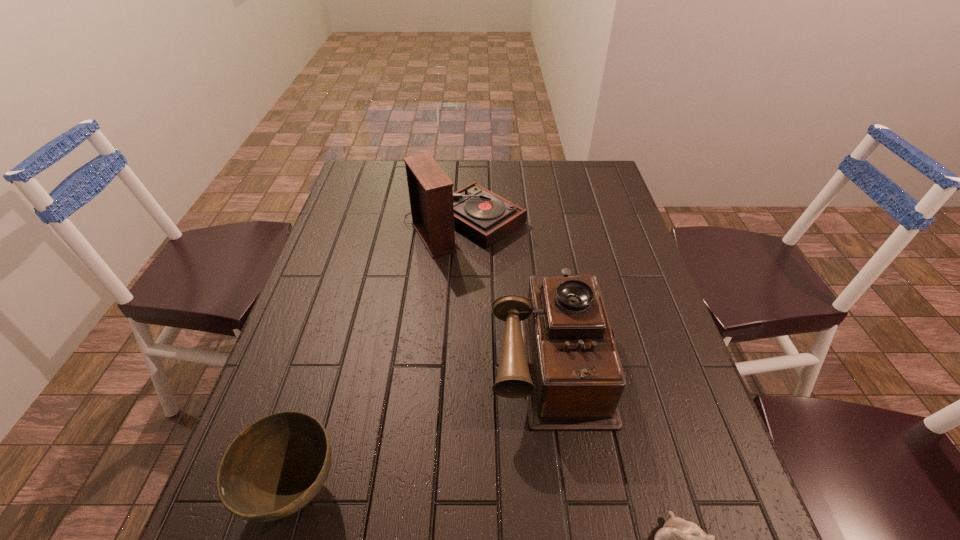
Locate an element on the screen. vacant space in between the farthest object and the nearer phonograph_record is located at coordinates (507, 291).

What are the coordinates of `object that is the second closest to the shortest object` in the screenshot? It's located at (277, 465).

Select which object appears as the third closest to the farthest object. Please provide its 2D coordinates. Your answer should be formatted as a tuple, i.e. [(x, y)], where the tuple contains the x and y coordinates of a point satisfying the conditions above.

[(679, 539)]